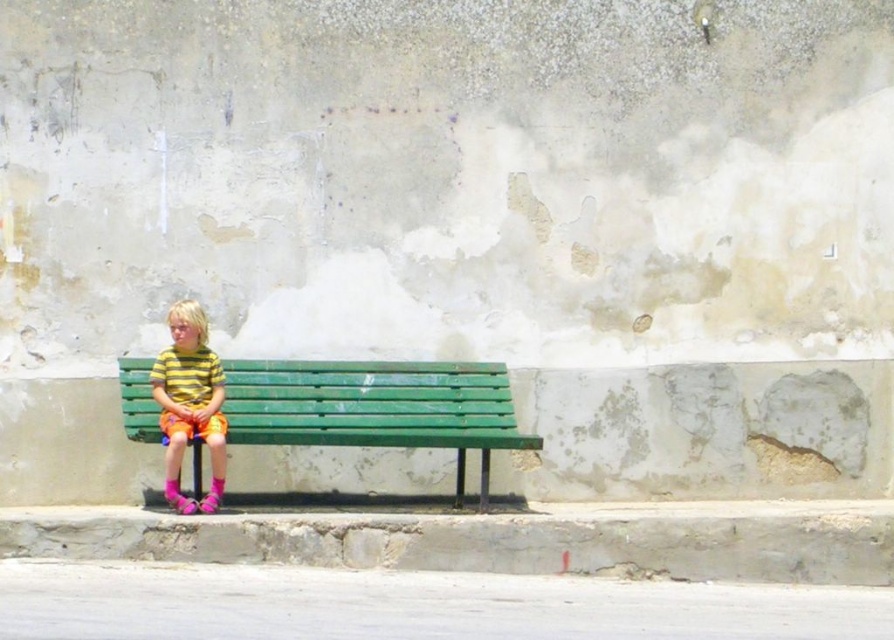
Question: Can you confirm if green painted wood bench at center is positioned above striped cotton shirt at center?

Choices:
 (A) yes
 (B) no

Answer: (B)

Question: Can you confirm if green painted wood bench at center is smaller than striped cotton shirt at center?

Choices:
 (A) yes
 (B) no

Answer: (B)

Question: Is green painted wood bench at center wider than striped cotton shirt at center?

Choices:
 (A) yes
 (B) no

Answer: (A)

Question: Which point is closer to the camera?

Choices:
 (A) (170, 426)
 (B) (372, 420)

Answer: (A)

Question: Among these objects, which one is nearest to the camera?

Choices:
 (A) striped cotton shirt at center
 (B) green painted wood bench at center

Answer: (A)